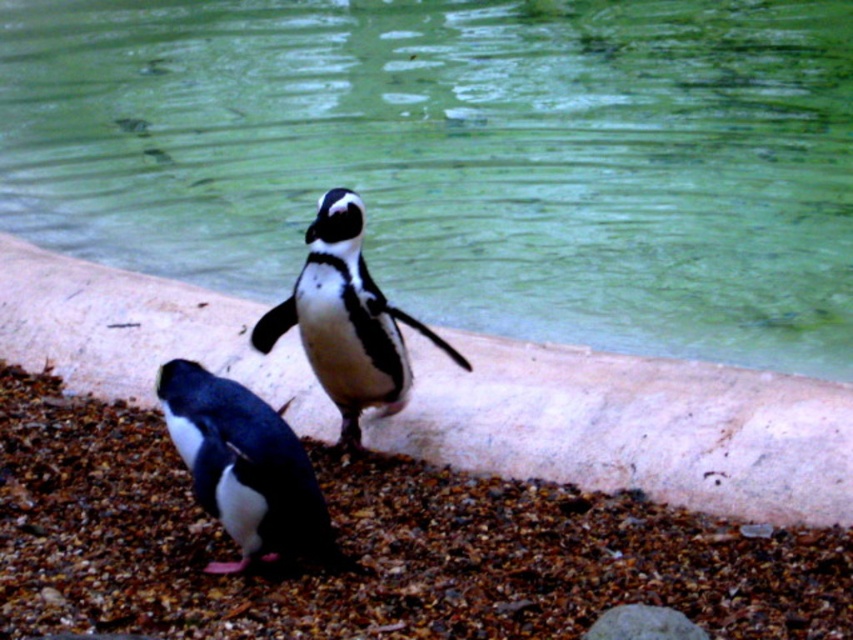
Question: Is black matte penguin at lower left below gray rough stone at lower center?

Choices:
 (A) yes
 (B) no

Answer: (B)

Question: Which point appears closest to the camera in this image?

Choices:
 (A) (662, 476)
 (B) (15, 125)

Answer: (A)

Question: Which object is the closest to the green water at center?

Choices:
 (A) white stone ledge at center
 (B) black matte penguin at lower left

Answer: (A)

Question: Which of these objects is positioned closest to the black and white feathers at center?

Choices:
 (A) gray rough stone at lower center
 (B) green water at center
 (C) black matte penguin at lower left

Answer: (C)

Question: Is green water at center positioned behind black matte penguin at lower left?

Choices:
 (A) no
 (B) yes

Answer: (B)

Question: Can you confirm if black matte penguin at lower left is wider than gray rough stone at lower center?

Choices:
 (A) yes
 (B) no

Answer: (A)